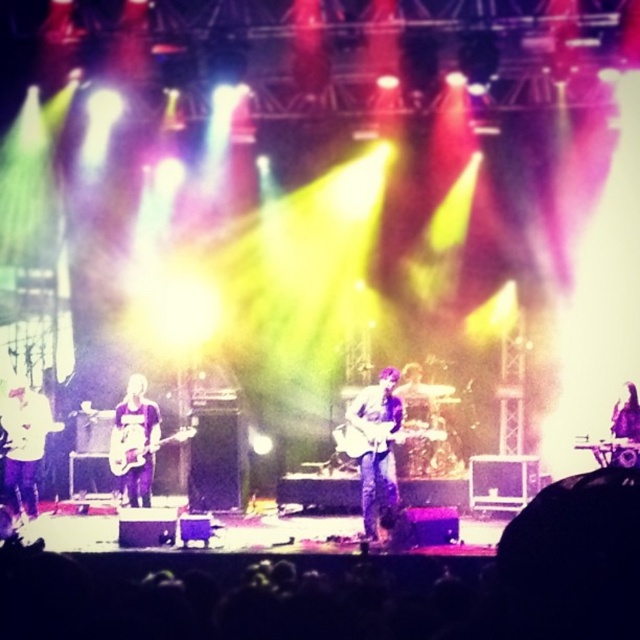
Question: Is matte white shirt at left above purple fabric guitar at center?

Choices:
 (A) yes
 (B) no

Answer: (B)

Question: Which point appears closest to the camera in this image?

Choices:
 (A) (364, 500)
 (B) (141, 390)
 (C) (120, 449)

Answer: (A)

Question: Which point appears farthest from the camera in this image?

Choices:
 (A) tap(12, 467)
 (B) tap(371, 422)
 (C) tap(129, 458)
 (D) tap(140, 500)

Answer: (A)

Question: Is shiny silver guitar at center bigger than matte white shirt at left?

Choices:
 (A) no
 (B) yes

Answer: (B)

Question: Which object is farther from the camera taking this photo?

Choices:
 (A) purple fabric guitar at center
 (B) glossy electric guitar at center
 (C) shiny silver guitar at center
 (D) matte white shirt at left

Answer: (D)

Question: Is purple fabric guitar at center thinner than glossy electric guitar at center?

Choices:
 (A) yes
 (B) no

Answer: (A)